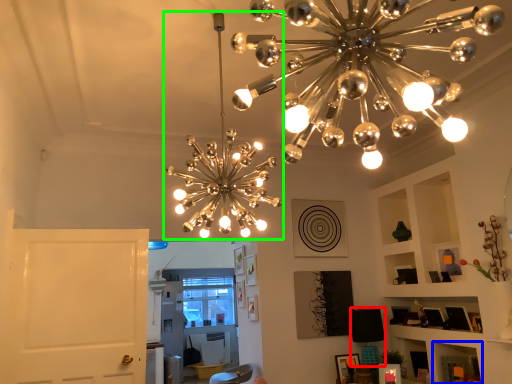
Question: Which object is positioned farthest from lamp (highlighted by a red box)? Select from shelf (highlighted by a blue box) and lamp (highlighted by a green box).

Choices:
 (A) shelf
 (B) lamp

Answer: (B)